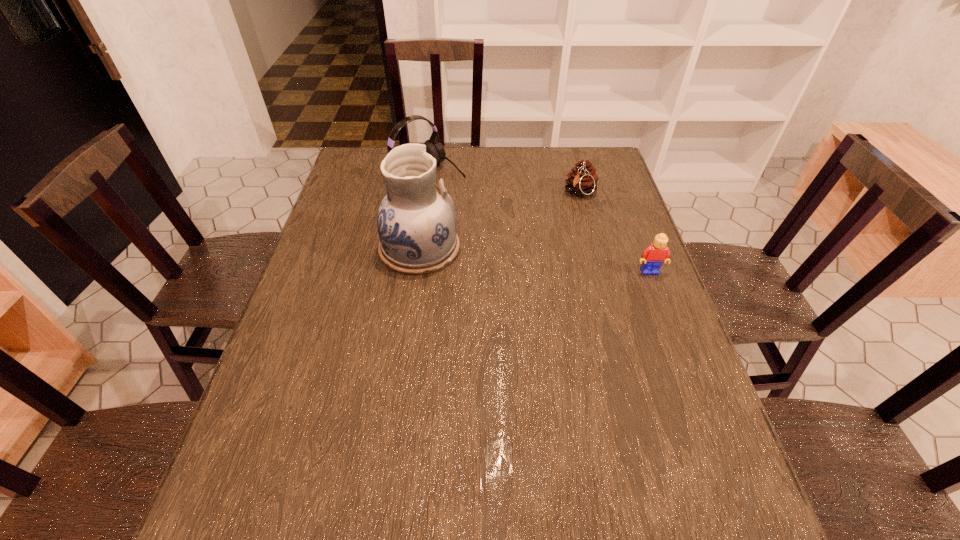
This screenshot has height=540, width=960. Find the location of `free space at the near edge of the desktop`. free space at the near edge of the desktop is located at coordinates (580, 447).

Locate an element on the screen. This screenshot has width=960, height=540. free point at the left edge is located at coordinates (362, 272).

Locate an element on the screen. vacant space at the right edge is located at coordinates (593, 235).

Identify the location of free space at the far left corner of the desktop. (353, 165).

Where is `vacant region at the near left corner`? This screenshot has height=540, width=960. vacant region at the near left corner is located at coordinates (319, 436).

Identify the location of vacant point at the far right corner. Image resolution: width=960 pixels, height=540 pixels. (577, 163).

Locate an element on the screen. This screenshot has width=960, height=540. vacant point at the near right corner is located at coordinates (712, 437).

Locate an element on the screen. This screenshot has height=540, width=960. blank region between the rightmost object and the third shortest object is located at coordinates (539, 222).

What are the coordinates of `vacant area between the pinecone and the rightmost object` in the screenshot? It's located at (614, 232).

Find the location of a particular element. This screenshot has width=960, height=540. free space that is in between the third shortest object and the rightmost object is located at coordinates (539, 222).